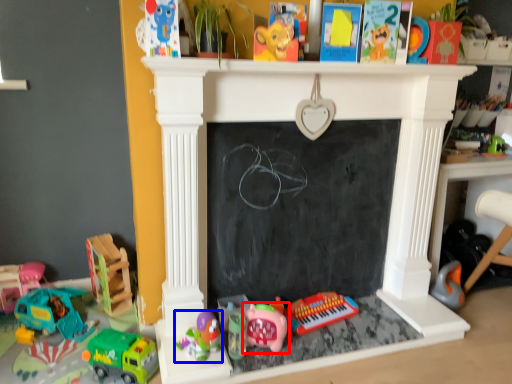
Question: Which object is closer to the camera taking this photo, toy (highlighted by a red box) or toy (highlighted by a blue box)?

Choices:
 (A) toy
 (B) toy

Answer: (B)